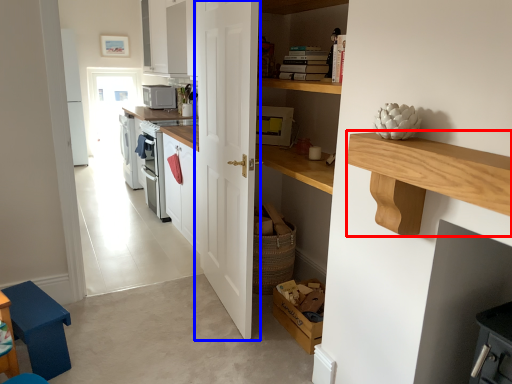
Question: Which object appears closest to the camera in this image, counter (highlighted by a red box) or door (highlighted by a blue box)?

Choices:
 (A) counter
 (B) door

Answer: (A)